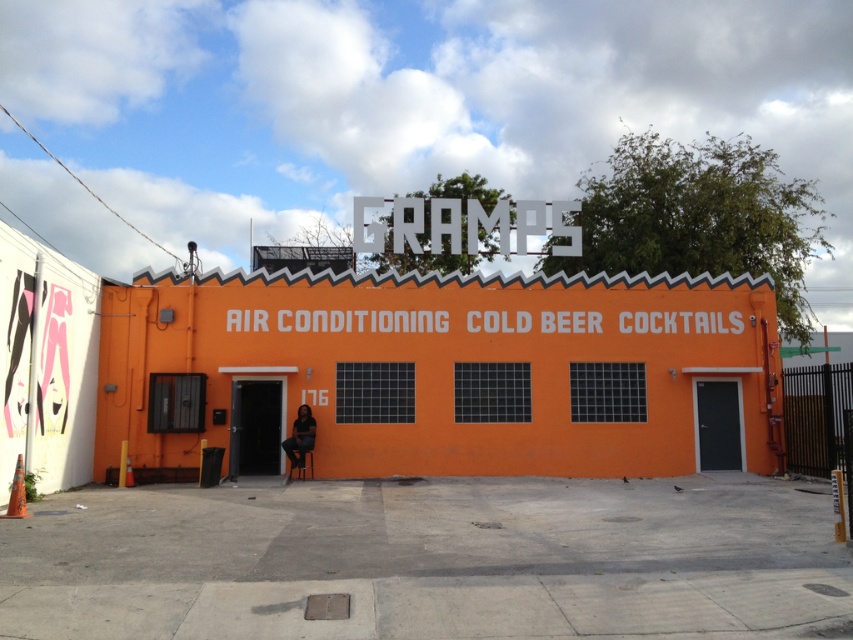
Image resolution: width=853 pixels, height=640 pixels. What do you see at coordinates (523, 225) in the screenshot?
I see `white plastic sign at upper center` at bounding box center [523, 225].

Which is more to the left, white plastic sign at upper center or matte black chair at center?

Positioned to the left is matte black chair at center.

Which is in front, point (518, 228) or point (294, 448)?

Point (294, 448) is more forward.

This screenshot has height=640, width=853. Identify the location of white plastic sign at upper center. point(523,225).